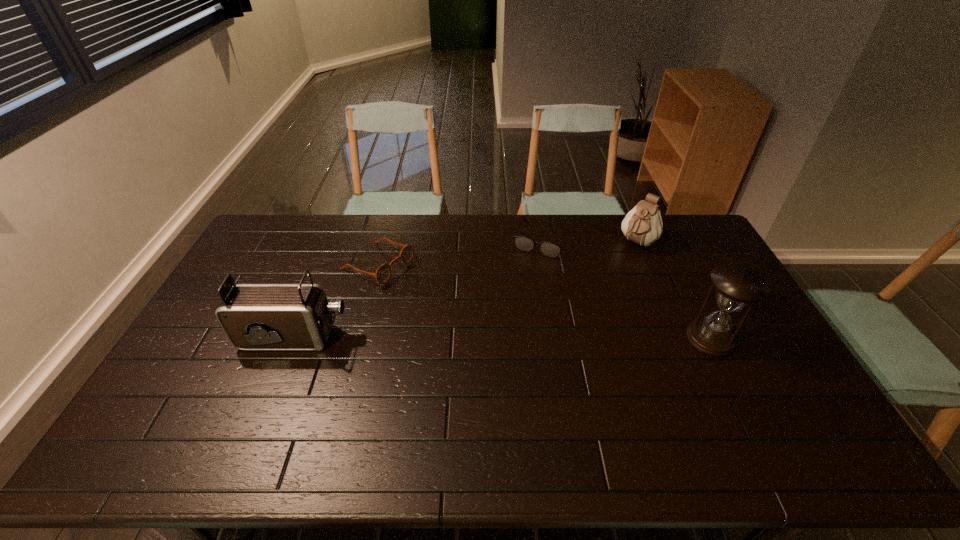
At what (x,y) coordinates should I click in order to perform the action: click on free spot between the hourglass and the third object from left to right. Please return your answer as a coordinate pair (x, y). Looking at the image, I should click on (627, 289).

You are a GUI agent. You are given a task and a screenshot of the screen. Output one action in this format:
    pyautogui.click(x=<x>, y=<y>)
    Task: Click on the vacant region between the right spectacles and the hourglass
    Image resolution: width=960 pixels, height=540 pixels.
    Given the screenshot: What is the action you would take?
    pyautogui.click(x=627, y=289)

You are a GUI agent. You are given a task and a screenshot of the screen. Output one action in this format:
    pyautogui.click(x=<x>, y=<y>)
    Task: Click on the free spot between the hourglass and the left spectacles
    
    Given the screenshot: What is the action you would take?
    [544, 301]

This screenshot has width=960, height=540. Identify the location of the third closest object relative to the pouch. 383,273.

Identify the location of the fourth closest object relative to the right spectacles. The width and height of the screenshot is (960, 540). (253, 316).

The width and height of the screenshot is (960, 540). In order to click on vacant region that satisfies the following two spatial constraints: 1. on the front side of the third object from right to left; 2. on the left side of the third shortest object in this screenshot , I will do `click(543, 242)`.

I want to click on vacant area that satisfies the following two spatial constraints: 1. on the front side of the left spectacles; 2. on the right side of the hourglass, so click(358, 338).